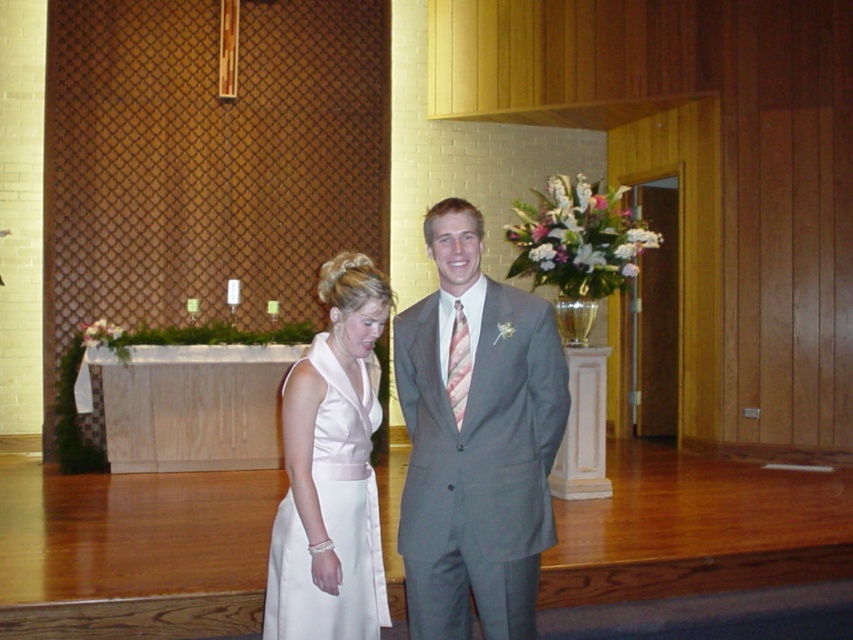
Question: Which is nearer to the white satin dress at center?

Choices:
 (A) gray suit at center
 (B) pink striped tie at center

Answer: (A)

Question: Can you confirm if gray suit at center is positioned to the right of pink striped tie at center?

Choices:
 (A) yes
 (B) no

Answer: (A)

Question: From the image, what is the correct spatial relationship of gray suit at center in relation to white satin dress at center?

Choices:
 (A) above
 (B) below

Answer: (A)

Question: Which of the following is the farthest from the observer?

Choices:
 (A) (329, 525)
 (B) (503, 365)
 (C) (456, 310)

Answer: (A)

Question: Is gray suit at center thinner than white satin dress at center?

Choices:
 (A) no
 (B) yes

Answer: (A)

Question: Which point appears closest to the camera in this image?

Choices:
 (A) (437, 380)
 (B) (328, 465)
 (C) (457, 400)

Answer: (C)